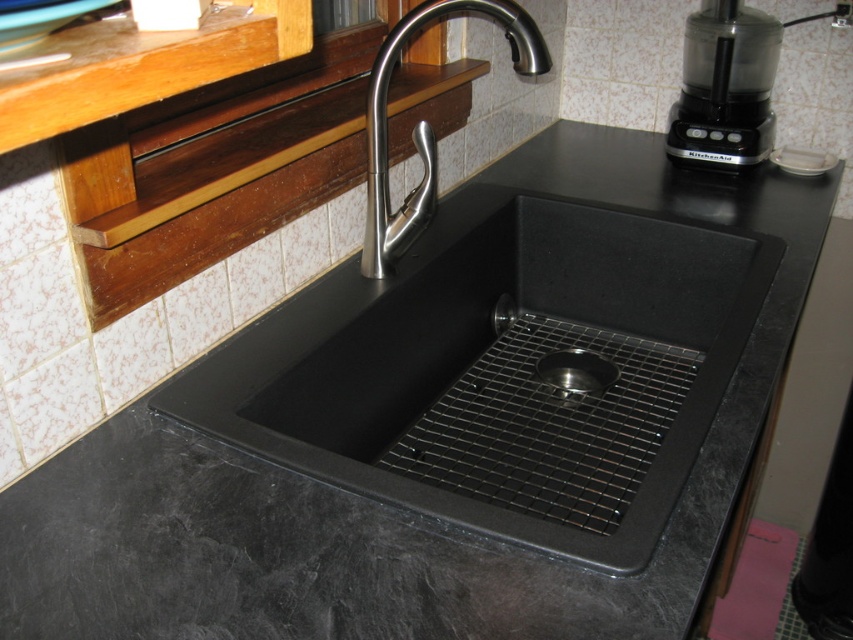
You are organizing the kitchen and need to move the black plastic food processor at upper right closer to the sink. Can you move it directly in front of the satin nickel faucet at center without moving any other items?

The satin nickel faucet at center is currently behind the black plastic food processor at upper right, so moving the black plastic food processor at upper right directly in front of the satin nickel faucet at center would require placing it where the faucet is already positioned. This isn t possible without moving the faucet or other items, so the answer is no.

You are a chef preparing to place a cutting board on the counter near the sink. The black plastic food processor at upper right is in the way. Where should you move it to make space?

The black plastic food processor at upper right is located at point (724, 86). To make space for the cutting board, move it to a different area of the counter away from that position.

You are organizing the kitchen and need to place the black plastic food processor at upper right and the metallic silver drain at center. Since the countertop space is limited, which object should you prioritize keeping in its current position based on size?

The black plastic food processor at upper right is bigger than the metallic silver drain at center, so you should prioritize keeping the black plastic food processor at upper right in its current position to accommodate its larger size.